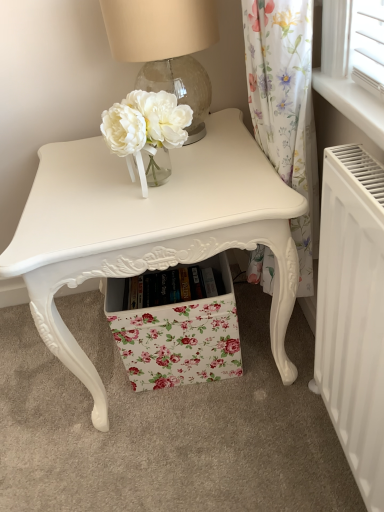
Question: Is white matte radiator at lower right aimed at floral fabric drawer at center?

Choices:
 (A) yes
 (B) no

Answer: (B)

Question: Are white matte radiator at lower right and floral fabric drawer at center located far from each other?

Choices:
 (A) no
 (B) yes

Answer: (A)

Question: Is white matte radiator at lower right closer to camera compared to floral fabric drawer at center?

Choices:
 (A) no
 (B) yes

Answer: (B)

Question: Does white matte radiator at lower right have a greater height compared to floral fabric drawer at center?

Choices:
 (A) yes
 (B) no

Answer: (A)

Question: From the image's perspective, does white matte radiator at lower right appear lower than floral fabric drawer at center?

Choices:
 (A) yes
 (B) no

Answer: (A)

Question: Is white matte radiator at lower right at the right side of floral fabric drawer at center?

Choices:
 (A) yes
 (B) no

Answer: (A)

Question: Is translucent glass table lamp at upper center at the left side of floral fabric drawer at center?

Choices:
 (A) no
 (B) yes

Answer: (B)

Question: From the image's perspective, is translucent glass table lamp at upper center below floral fabric drawer at center?

Choices:
 (A) no
 (B) yes

Answer: (A)

Question: Is floral fabric drawer at center completely or partially inside translucent glass table lamp at upper center?

Choices:
 (A) yes
 (B) no

Answer: (B)

Question: Does translucent glass table lamp at upper center lie in front of floral fabric drawer at center?

Choices:
 (A) no
 (B) yes

Answer: (B)

Question: Does translucent glass table lamp at upper center have a smaller size compared to floral fabric drawer at center?

Choices:
 (A) no
 (B) yes

Answer: (B)

Question: Is translucent glass table lamp at upper center completely or partially outside of floral fabric drawer at center?

Choices:
 (A) yes
 (B) no

Answer: (A)

Question: Is translucent glass table lamp at upper center in front of matte white table at center?

Choices:
 (A) no
 (B) yes

Answer: (A)